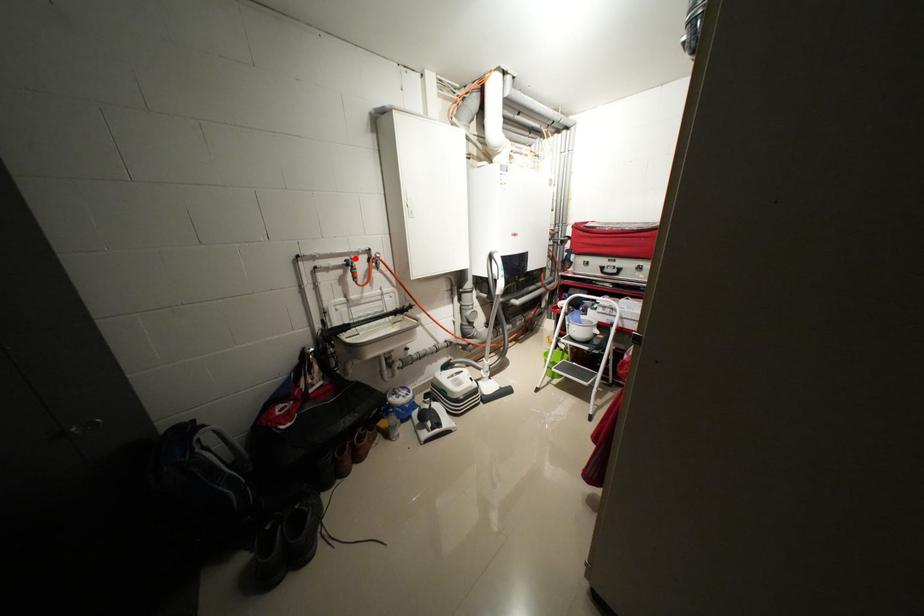
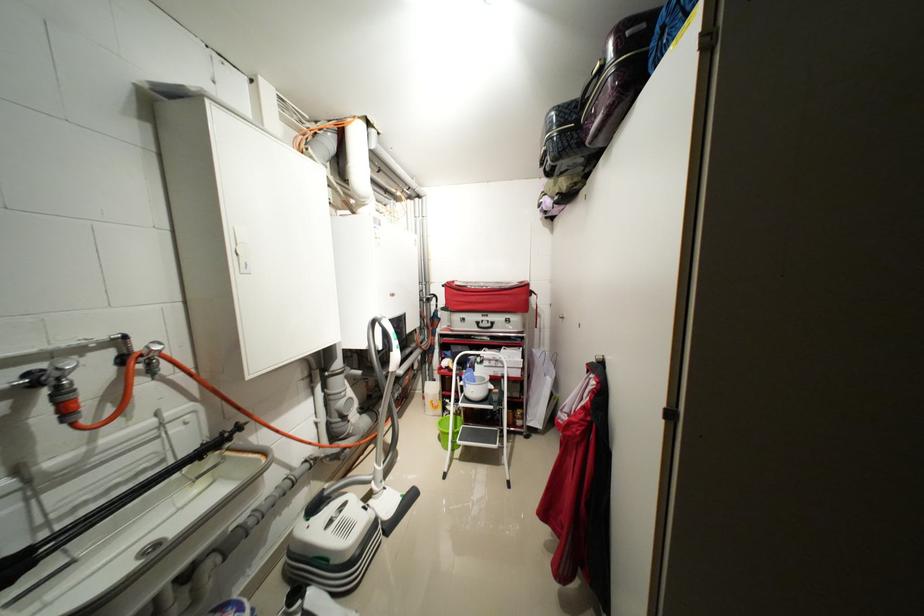
Locate, in the second image, the point that corresponds to the highlighted location in the first image.

(46, 367)